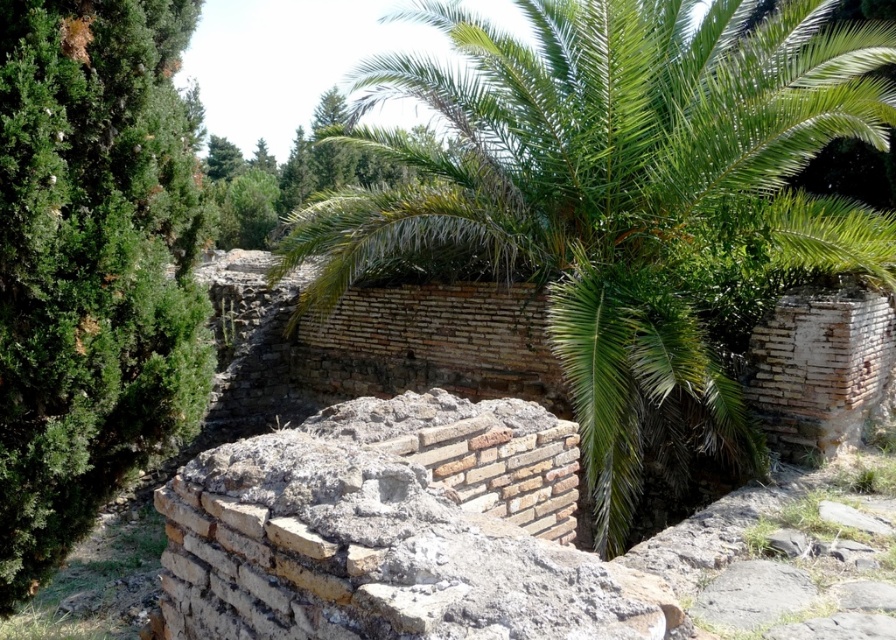
You are an archaeologist standing at the center of the archaeological site. You notice the green leafy palm at center. Can you determine its exact location in the image using coordinates?

The green leafy palm at center is located at coordinates point (621, 200).